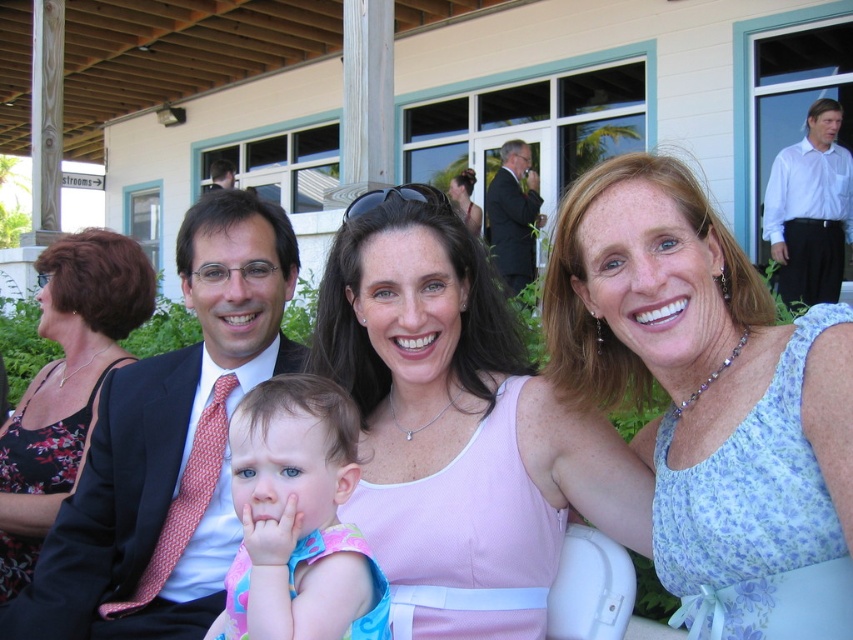
Question: In this image, where is pink fabric dress at center located relative to white shirt at upper right?

Choices:
 (A) above
 (B) below

Answer: (B)

Question: Is pink fabric dress at center wider than matte black suit at center?

Choices:
 (A) yes
 (B) no

Answer: (B)

Question: Based on their relative distances, which object is nearer to the pastel floral dress at center?

Choices:
 (A) matte black suit at upper center
 (B) matte black suit at center

Answer: (B)

Question: Is blue floral dress at center smaller than black floral dress at left?

Choices:
 (A) yes
 (B) no

Answer: (A)

Question: Among these points, which one is nearest to the camera?

Choices:
 (A) (500, 176)
 (B) (3, 451)
 (C) (291, 228)

Answer: (C)

Question: Which object appears closest to the camera in this image?

Choices:
 (A) black floral dress at left
 (B) white shirt at upper right
 (C) matte black suit at center

Answer: (C)